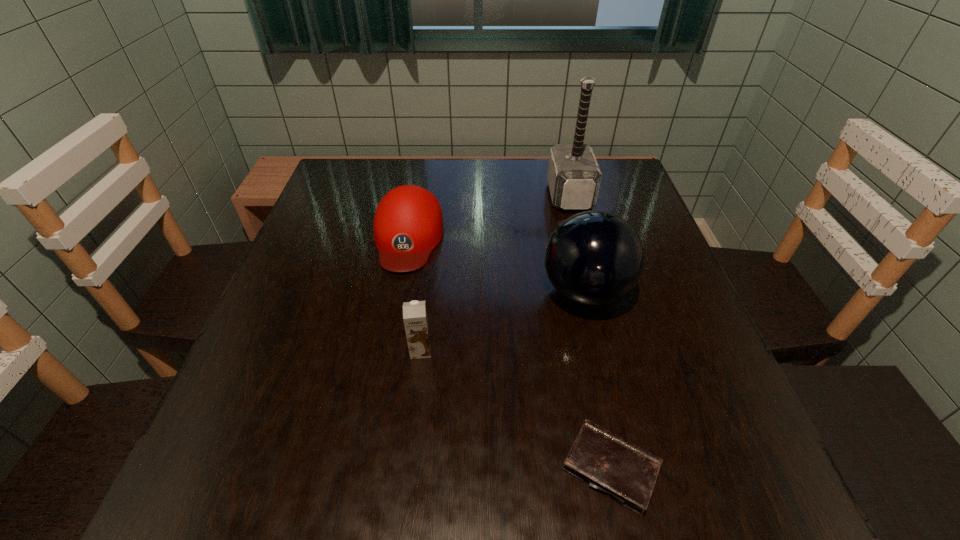
The width and height of the screenshot is (960, 540). I want to click on empty space between the fourth farthest object and the baseball cap, so click(x=415, y=294).

The width and height of the screenshot is (960, 540). What are the coordinates of `empty location between the second tallest object and the baseball cap` in the screenshot? It's located at (496, 265).

Locate an element on the screen. blank region between the shortest object and the bowling ball is located at coordinates (598, 380).

You are a GUI agent. You are given a task and a screenshot of the screen. Output one action in this format:
    pyautogui.click(x=<x>, y=<y>)
    Task: Click on the free space between the chocolate milk and the second tallest object
    
    Given the screenshot: What is the action you would take?
    point(503,321)

Identify the location of vacant region between the bowling ball and the shortest object. (598, 380).

I want to click on vacant space in between the fourth farthest object and the baseball cap, so click(415, 294).

Identify which object is located as the nearest to the baseball cap. Please provide its 2D coordinates. Your answer should be formatted as a tuple, i.e. [(x, y)], where the tuple contains the x and y coordinates of a point satisfying the conditions above.

[(415, 319)]

Identify which object is the third closest to the bowling ball. Please provide its 2D coordinates. Your answer should be formatted as a tuple, i.e. [(x, y)], where the tuple contains the x and y coordinates of a point satisfying the conditions above.

[(408, 224)]

Locate an element on the screen. The width and height of the screenshot is (960, 540). blank space that satisfies the following two spatial constraints: 1. on the front-facing side of the second nearest object; 2. on the right side of the baseball cap is located at coordinates (387, 350).

At what (x,y) coordinates should I click in order to perform the action: click on free spot that satisfies the following two spatial constraints: 1. for striking with the head of the tallest object; 2. on the front side of the chocolate milk. Please return your answer as a coordinate pair (x, y). Looking at the image, I should click on (610, 350).